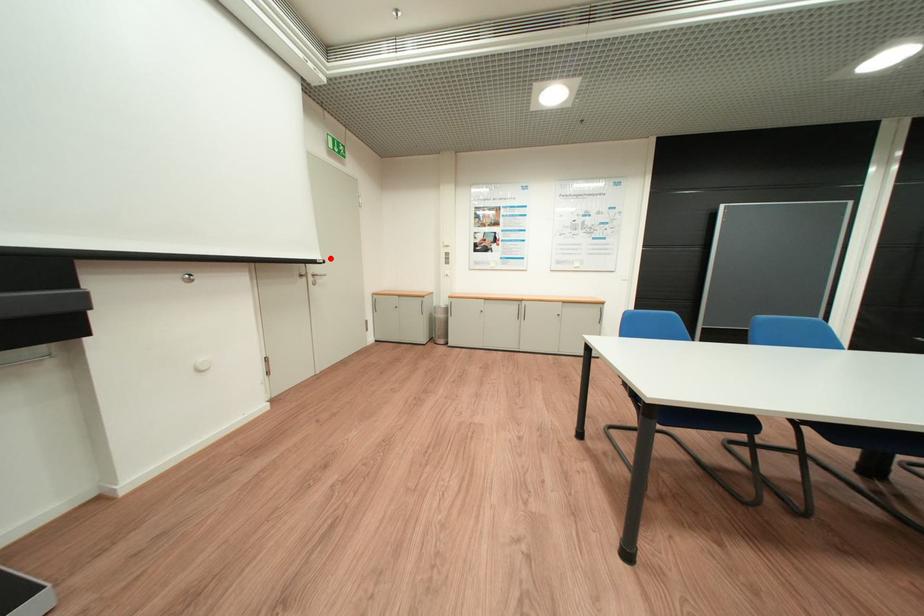
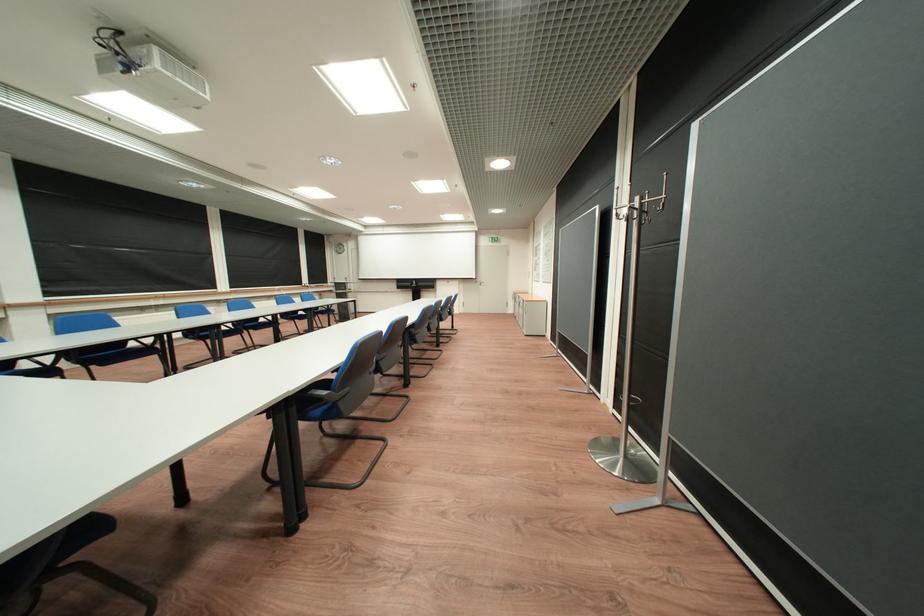
Question: I am providing you with two images of the same scene from different viewpoints. Given a red point in image1, look at the same physical point in image2. Is it:

Choices:
 (A) Closer to the viewpoint
 (B) Farther from the viewpoint

Answer: (B)